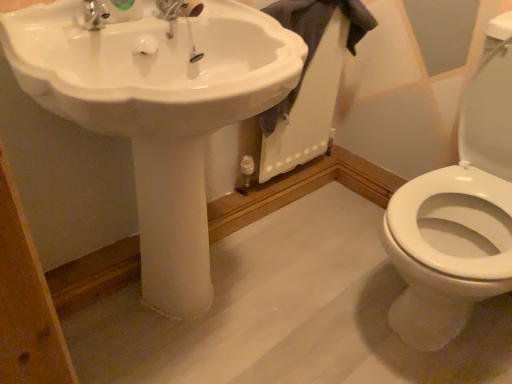
Question: Based on their sizes in the image, would you say white glossy sink at center is bigger or smaller than gray cotton towel at upper right?

Choices:
 (A) small
 (B) big

Answer: (B)

Question: From a real-world perspective, relative to gray cotton towel at upper right, is white glossy sink at center vertically above or below?

Choices:
 (A) above
 (B) below

Answer: (B)

Question: In terms of width, does white glossy sink at center look wider or thinner when compared to gray cotton towel at upper right?

Choices:
 (A) thin
 (B) wide

Answer: (B)

Question: Based on their sizes in the image, would you say gray cotton towel at upper right is bigger or smaller than white glossy sink at center?

Choices:
 (A) big
 (B) small

Answer: (B)

Question: From a real-world perspective, relative to white glossy sink at center, is gray cotton towel at upper right vertically above or below?

Choices:
 (A) above
 (B) below

Answer: (A)

Question: Relative to white glossy sink at center, is gray cotton towel at upper right in front or behind?

Choices:
 (A) behind
 (B) front

Answer: (A)

Question: Is point 289,104 closer or farther from the camera than point 291,46?

Choices:
 (A) farther
 (B) closer

Answer: (A)